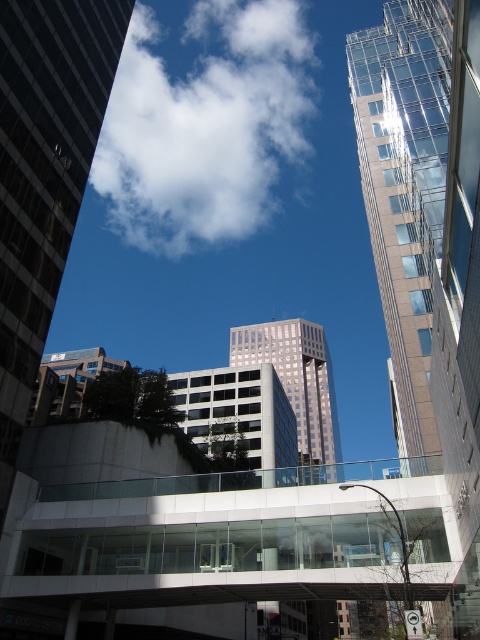
Question: Among these objects, which one is farthest from the camera?

Choices:
 (A) white fluffy cloud at upper center
 (B) glassy reflective skyscraper at center

Answer: (A)

Question: Where is white fluffy cloud at upper center located in relation to light gray glass building at center in the image?

Choices:
 (A) left
 (B) right

Answer: (A)

Question: Does glassy reflective skyscraper at center appear under clear glass skyscraper at upper right?

Choices:
 (A) yes
 (B) no

Answer: (B)

Question: Which point is farther to the camera?

Choices:
 (A) glassy reflective skyscraper at center
 (B) light gray glass building at center

Answer: (B)

Question: Where is clear glass skyscraper at upper right located in relation to light gray glass building at center in the image?

Choices:
 (A) right
 (B) left

Answer: (A)

Question: Which object appears closest to the camera in this image?

Choices:
 (A) clear glass skyscraper at upper right
 (B) white fluffy cloud at upper center

Answer: (A)